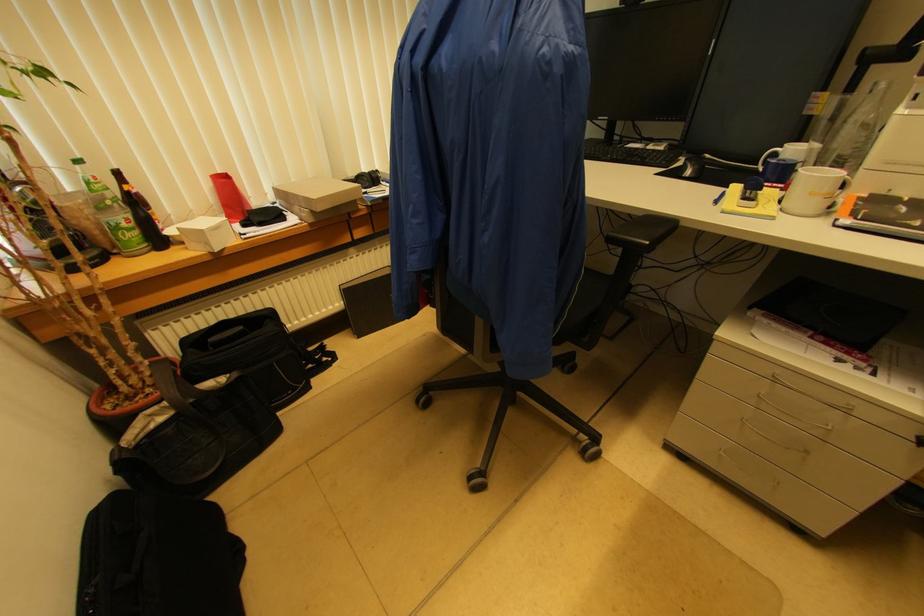
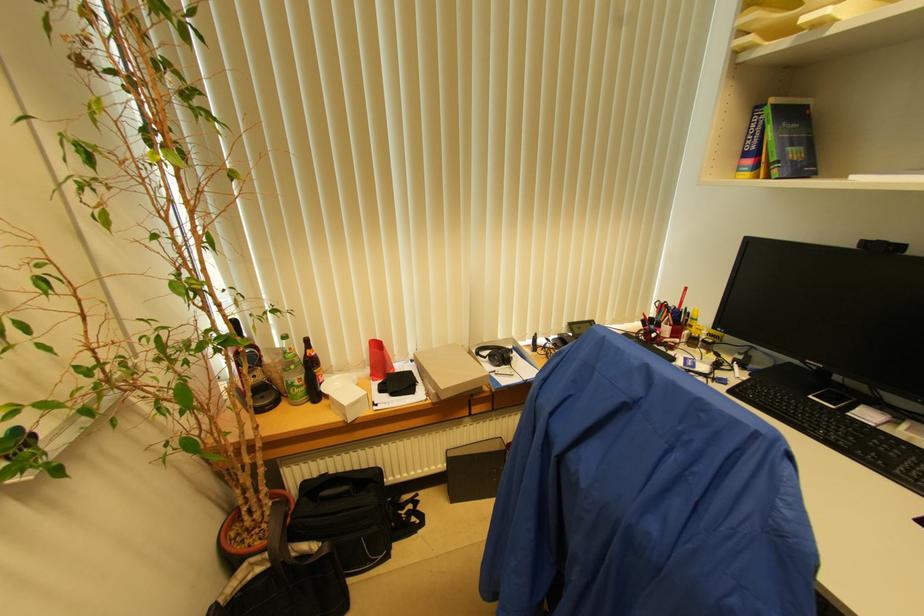
The point at (341, 288) is marked in the first image. Where is the corresponding point in the second image?

(447, 453)